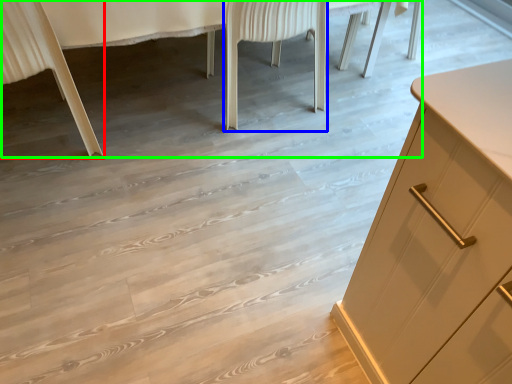
Question: Which is nearer to the chair (highlighted by a red box)? chair (highlighted by a blue box) or vanity (highlighted by a green box).

Choices:
 (A) chair
 (B) vanity

Answer: (B)